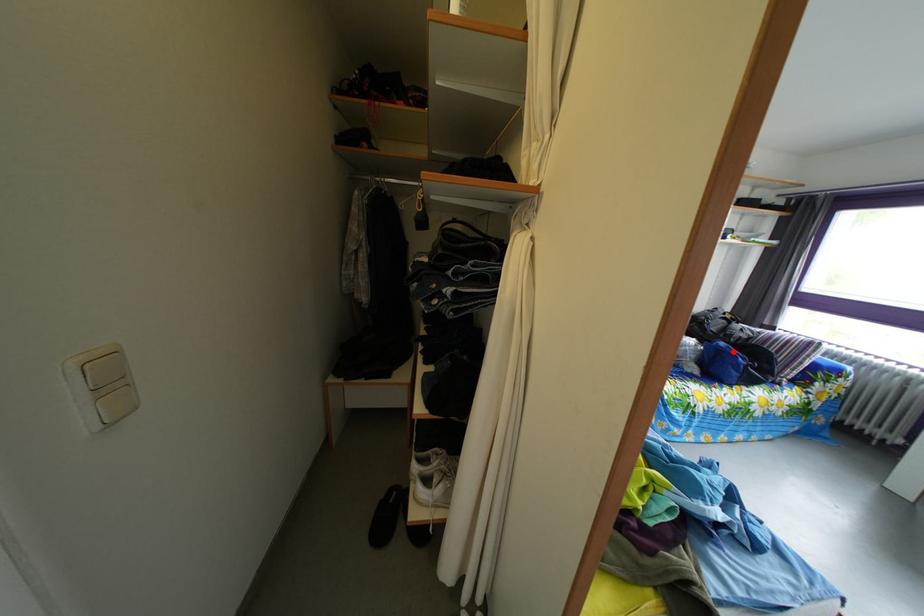
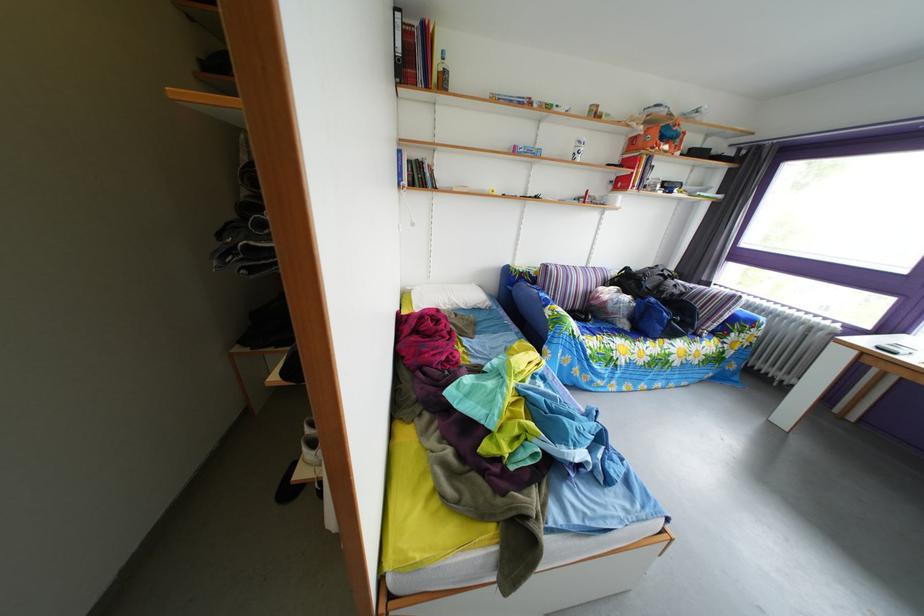
Find the pixel in the second image that matches the highlighted location in the first image.

(663, 307)